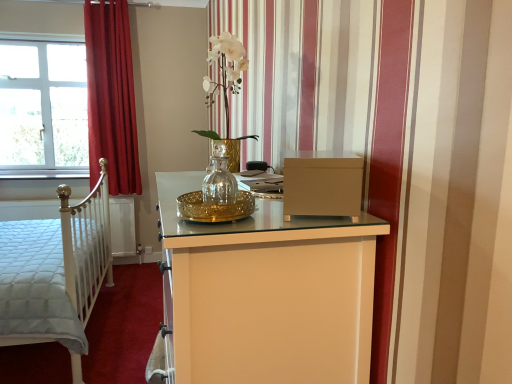
Question: From the image's perspective, would you say white quilted fabric bed at left is shown under clear glass vase at center?

Choices:
 (A) yes
 (B) no

Answer: (A)

Question: Is white quilted fabric bed at left aimed at clear glass vase at center?

Choices:
 (A) no
 (B) yes

Answer: (A)

Question: Is white quilted fabric bed at left to the left of clear glass vase at center from the viewer's perspective?

Choices:
 (A) no
 (B) yes

Answer: (B)

Question: Considering the relative sizes of white quilted fabric bed at left and clear glass vase at center in the image provided, is white quilted fabric bed at left thinner than clear glass vase at center?

Choices:
 (A) no
 (B) yes

Answer: (A)

Question: Is white quilted fabric bed at left turned away from clear glass vase at center?

Choices:
 (A) yes
 (B) no

Answer: (B)

Question: Is white quilted fabric bed at left positioned far away from clear glass vase at center?

Choices:
 (A) yes
 (B) no

Answer: (A)

Question: From a real-world perspective, is matte brown file cabinet at center beneath clear glass vase at center?

Choices:
 (A) yes
 (B) no

Answer: (A)

Question: Is matte brown file cabinet at center shorter than clear glass vase at center?

Choices:
 (A) no
 (B) yes

Answer: (B)

Question: Is matte brown file cabinet at center positioned in front of clear glass vase at center?

Choices:
 (A) no
 (B) yes

Answer: (B)

Question: Is matte brown file cabinet at center taller than clear glass vase at center?

Choices:
 (A) no
 (B) yes

Answer: (A)

Question: Is matte brown file cabinet at center looking in the opposite direction of clear glass vase at center?

Choices:
 (A) yes
 (B) no

Answer: (B)

Question: Does matte brown file cabinet at center contain clear glass vase at center?

Choices:
 (A) yes
 (B) no

Answer: (B)

Question: Is white quilted fabric bed at left inside clear glass vase at center?

Choices:
 (A) no
 (B) yes

Answer: (A)